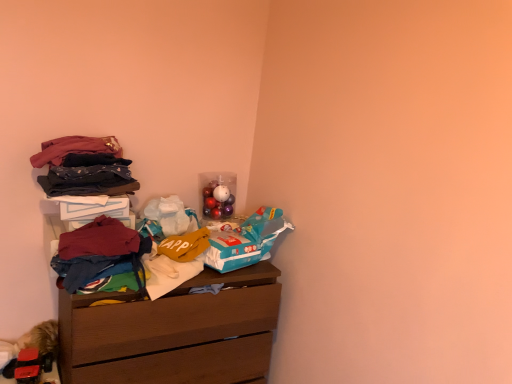
Find the location of a particular element. This screenshot has height=384, width=512. vacant region above multicolored fabric at center, which is the 1th clothing in bottom-to-top order (from a real-world perspective) is located at coordinates (103, 245).